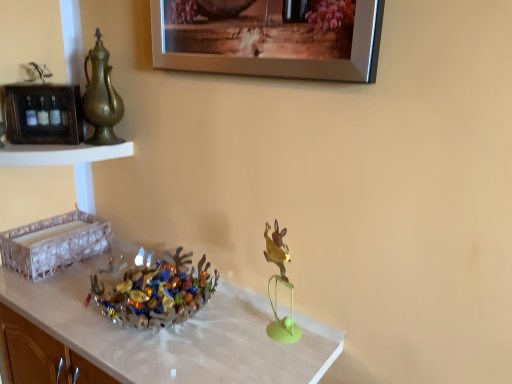
Where is `vacant space to the left of metallic gold rabbit at center`? This screenshot has height=384, width=512. vacant space to the left of metallic gold rabbit at center is located at coordinates (223, 337).